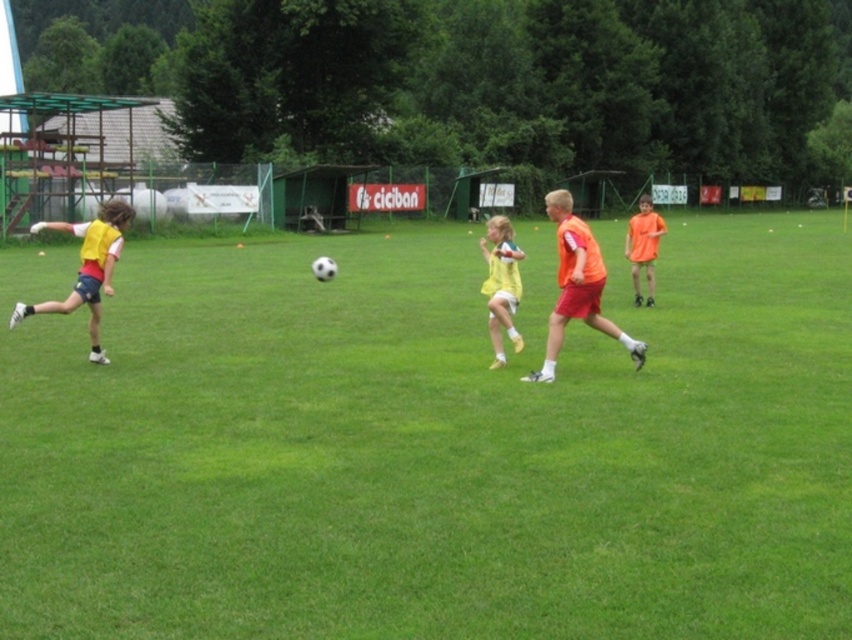
What are the coordinates of `yellow matte jersey at left` in the screenshot? It's located at (87, 268).

Can you confirm if yellow matte jersey at left is positioned to the right of yellow matte jersey at center?

No, yellow matte jersey at left is not to the right of yellow matte jersey at center.

This screenshot has height=640, width=852. Describe the element at coordinates (87, 268) in the screenshot. I see `yellow matte jersey at left` at that location.

The width and height of the screenshot is (852, 640). I want to click on yellow matte jersey at left, so click(x=87, y=268).

Between yellow matte jersey at center and orange matte shirt at right, which one is positioned lower?

yellow matte jersey at center

Is point (510, 282) farther from camera compared to point (652, 280)?

That is False.

Locate an element on the screen. yellow matte jersey at center is located at coordinates (501, 284).

Locate an element on the screen. yellow matte jersey at left is located at coordinates (87, 268).

This screenshot has width=852, height=640. What do you see at coordinates (87, 268) in the screenshot?
I see `yellow matte jersey at left` at bounding box center [87, 268].

This screenshot has width=852, height=640. I want to click on yellow matte jersey at left, so click(87, 268).